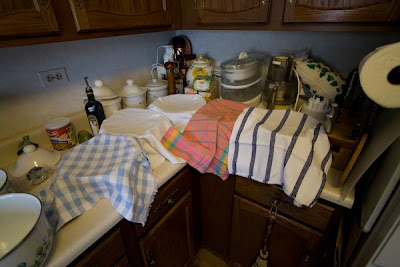
Find the location of a particular element. floor is located at coordinates (204, 257).